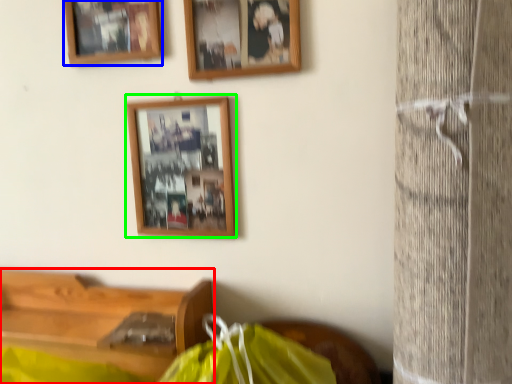
Question: Which object is the closest to the furniture (highlighted by a red box)? Choose among these: picture frame (highlighted by a blue box) or picture frame (highlighted by a green box).

Choices:
 (A) picture frame
 (B) picture frame

Answer: (B)